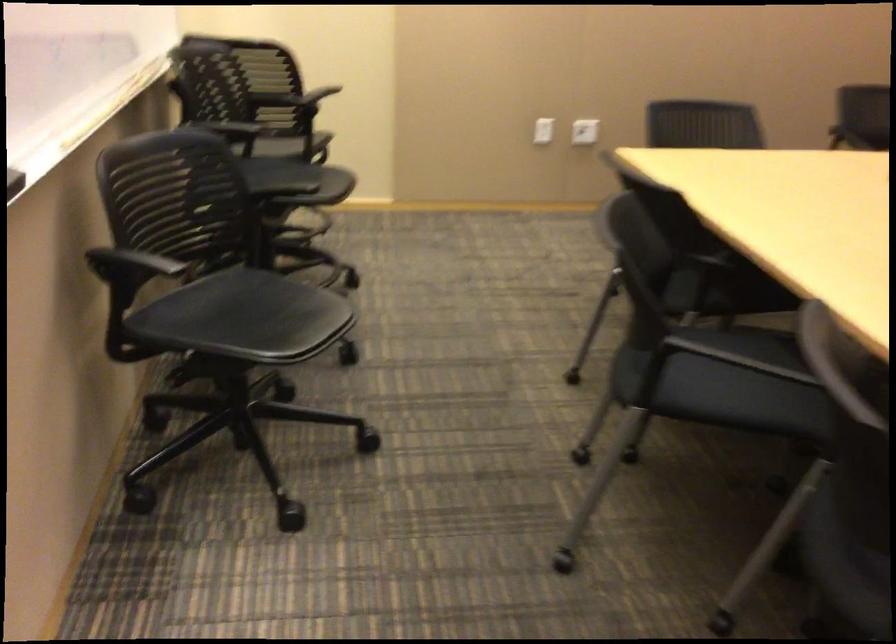
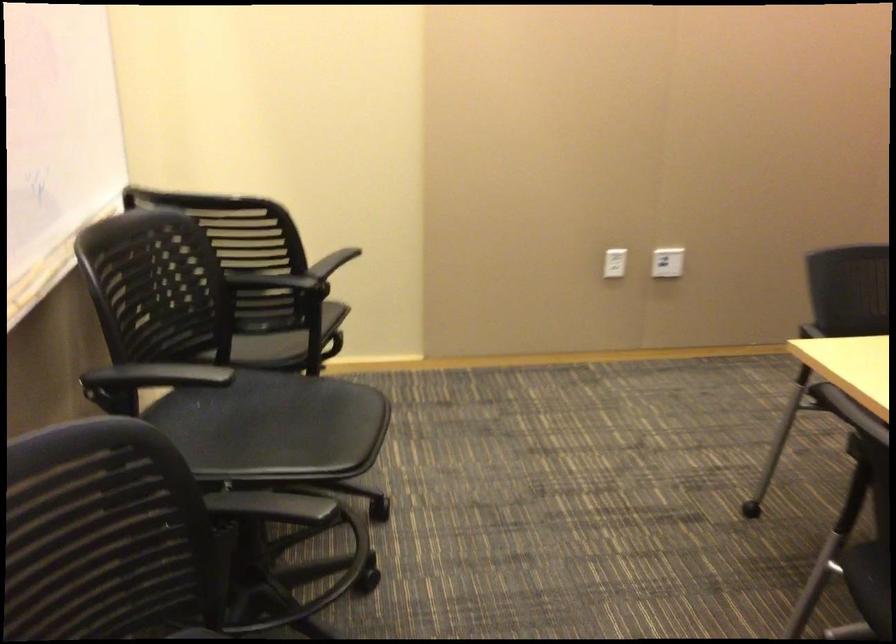
In the second image, find the point that corresponds to point 290,136 in the first image.

(287, 341)